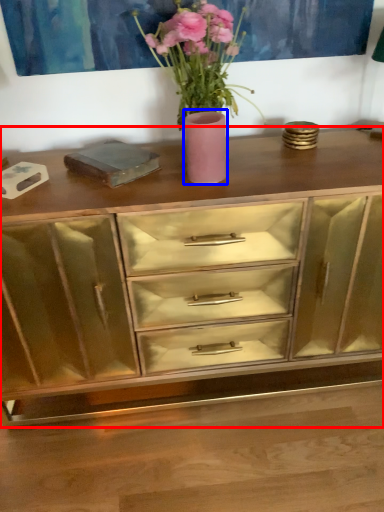
Question: Which object appears closest to the camera in this image, chest of drawers (highlighted by a red box) or vase (highlighted by a blue box)?

Choices:
 (A) chest of drawers
 (B) vase

Answer: (A)